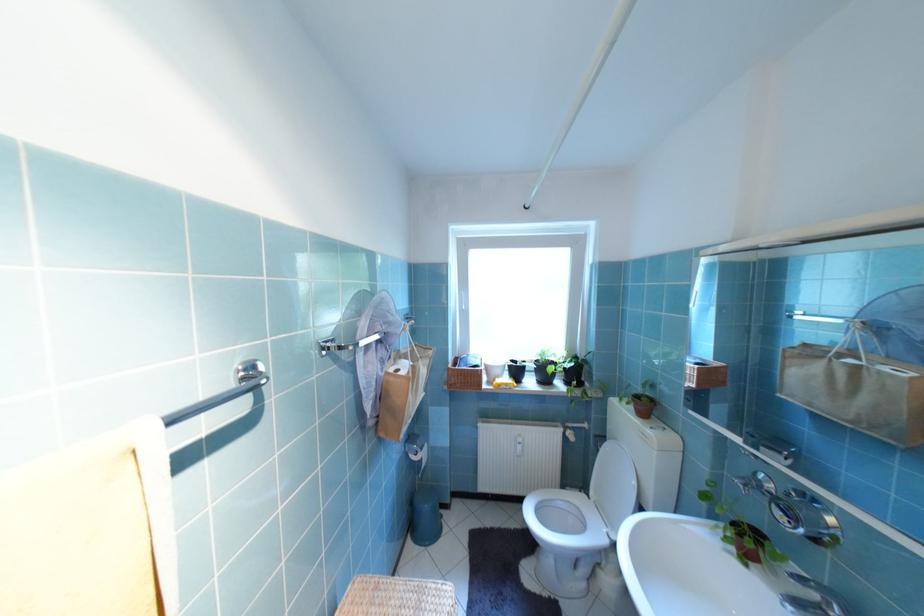
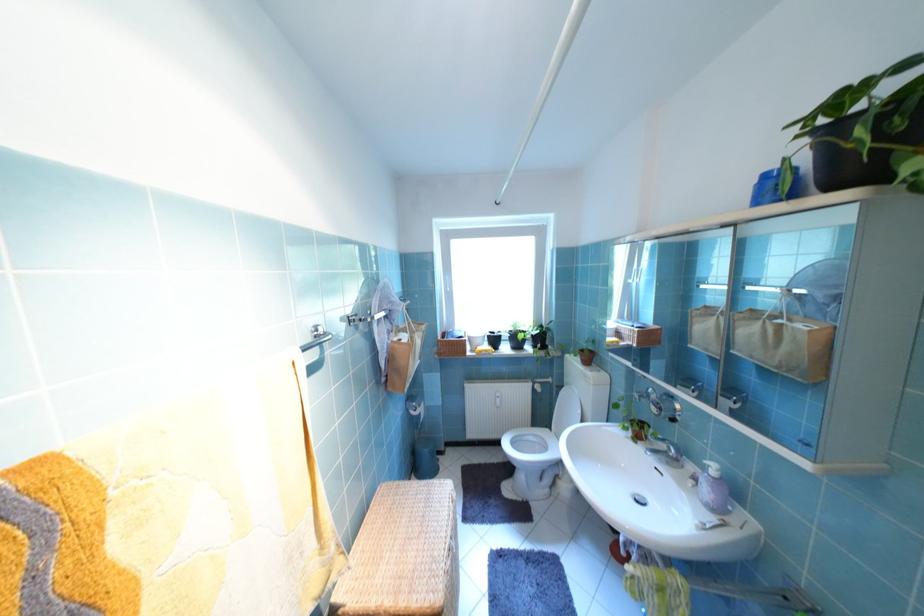
Where in the second image is the point corresponding to point (459, 366) from the first image?

(448, 339)